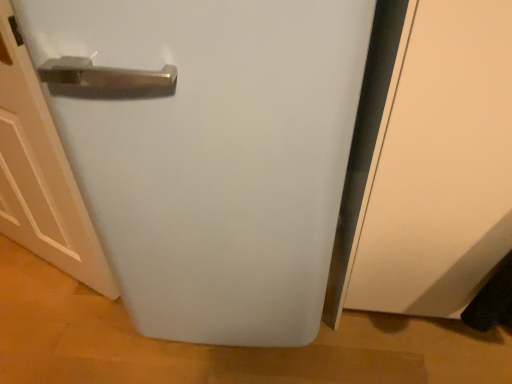
Where is `free spot below white matte door at left (from a real-world perspective)`? free spot below white matte door at left (from a real-world perspective) is located at coordinates (38, 290).